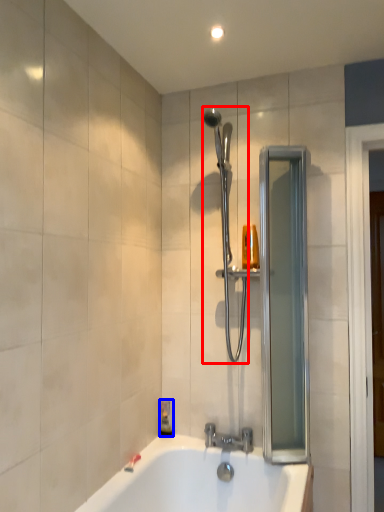
Question: Which object is closer to the camera taking this photo, shower (highlighted by a red box) or soap dispenser (highlighted by a blue box)?

Choices:
 (A) shower
 (B) soap dispenser

Answer: (A)